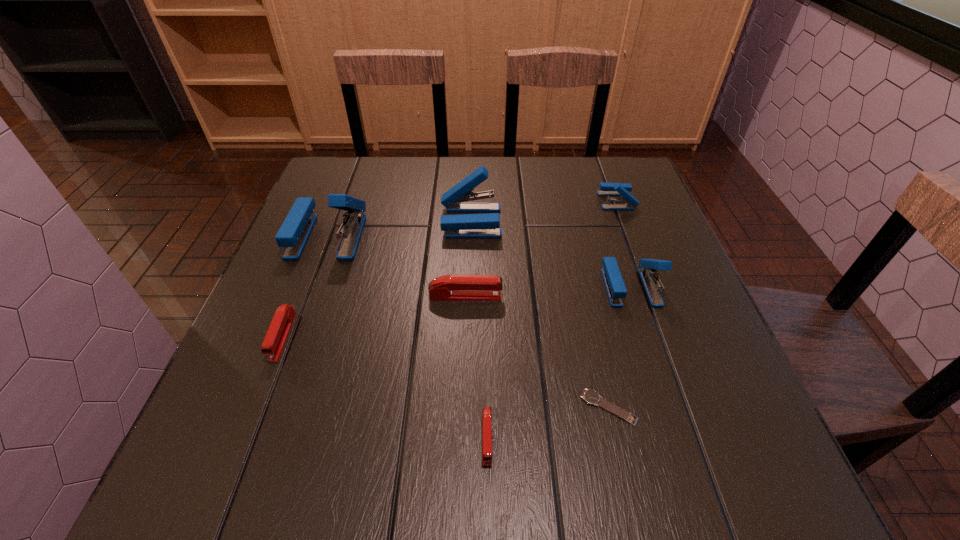
Locate an element on the screen. The width and height of the screenshot is (960, 540). empty location between the second shortest object and the fifth shortest object is located at coordinates (552, 320).

Identify the location of free space between the shortest stapler and the fifth shortest object. (552, 320).

Where is `the second closest object to the fourth tallest stapler`? The image size is (960, 540). the second closest object to the fourth tallest stapler is located at coordinates (487, 225).

At what (x,y) coordinates should I click in order to perform the action: click on the sixth closest object to the third tallest stapler. Please return your answer as a coordinate pair (x, y). Looking at the image, I should click on (293, 234).

Find the location of `stapler that stands as the fifth closest to the second smallest blue stapler`. stapler that stands as the fifth closest to the second smallest blue stapler is located at coordinates (293, 234).

Identify the location of stapler that stands as the second closest to the shortest object. The width and height of the screenshot is (960, 540). (616, 290).

Find the location of `the third closest blue stapler to the nearest red stapler`. the third closest blue stapler to the nearest red stapler is located at coordinates (293, 234).

Choose which blue stapler is the nearest neighbor to the farthest red stapler. Please provide its 2D coordinates. Your answer should be formatted as a tuple, i.e. [(x, y)], where the tuple contains the x and y coordinates of a point satisfying the conditions above.

[(487, 225)]

The image size is (960, 540). Identify the location of red stapler that is the third closest to the watch. (277, 334).

Where is `red stapler that is the third closest one to the fourth tallest stapler`? Image resolution: width=960 pixels, height=540 pixels. red stapler that is the third closest one to the fourth tallest stapler is located at coordinates tap(277, 334).